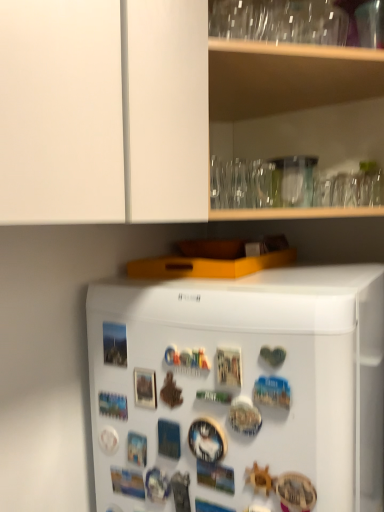
What do you see at coordinates (239, 391) in the screenshot? Image resolution: width=384 pixels, height=512 pixels. I see `white matte refrigerator at center` at bounding box center [239, 391].

What are the coordinates of `white matte refrigerator at center` in the screenshot? It's located at (239, 391).

Locate an element on the screen. transparent glassware at upper center is located at coordinates (103, 112).

In order to face transparent glassware at upper center, should I rotate leftwards or rightwards?

You should look right and rotate roughly 9.338 degrees.

The height and width of the screenshot is (512, 384). What do you see at coordinates (103, 112) in the screenshot? I see `transparent glassware at upper center` at bounding box center [103, 112].

You are a GUI agent. You are given a task and a screenshot of the screen. Output one action in this format:
    pyautogui.click(x=<x>, y=<y>)
    Task: Click on the white matte refrigerator at center
    This screenshot has width=384, height=512.
    Given the screenshot: What is the action you would take?
    pyautogui.click(x=239, y=391)

Is white matte refrigerator at center at the right side of transparent glassware at upper center?

No, white matte refrigerator at center is not to the right of transparent glassware at upper center.

Considering their positions, is white matte refrigerator at center located in front of or behind transparent glassware at upper center?

Visually, white matte refrigerator at center is located in front of transparent glassware at upper center.

Which point is more forward, (324, 461) or (188, 201)?

The point (324, 461) is closer.

From the image's perspective, between white matte refrigerator at center and transparent glassware at upper center, who is located below?

white matte refrigerator at center.

From a real-world perspective, between white matte refrigerator at center and transparent glassware at upper center, who is vertically lower?

In real-world perspective, white matte refrigerator at center is lower.

Which object is wider, white matte refrigerator at center or transparent glassware at upper center?

With larger width is white matte refrigerator at center.

Does white matte refrigerator at center have a greater height compared to transparent glassware at upper center?

Yes.

Considering the sizes of objects white matte refrigerator at center and transparent glassware at upper center in the image provided, who is bigger, white matte refrigerator at center or transparent glassware at upper center?

white matte refrigerator at center is bigger.

Would you say transparent glassware at upper center is part of white matte refrigerator at center's contents?

No, transparent glassware at upper center is not surrounded by white matte refrigerator at center.

Is there a large distance between white matte refrigerator at center and transparent glassware at upper center?

They are positioned close to each other.

Looking at this image, is white matte refrigerator at center turned away from transparent glassware at upper center?

No, transparent glassware at upper center is not at the back of white matte refrigerator at center.

This screenshot has height=512, width=384. Find the location of `cabinetry behind the white matte refrigerator at center`. cabinetry behind the white matte refrigerator at center is located at coordinates (103, 112).

Between transparent glassware at upper center and white matte refrigerator at center, which one appears on the right side from the viewer's perspective?

transparent glassware at upper center.

In the image, is transparent glassware at upper center positioned in front of or behind white matte refrigerator at center?

Clearly, transparent glassware at upper center is behind white matte refrigerator at center.

Considering the points (75, 110) and (91, 399), which point is in front, point (75, 110) or point (91, 399)?

Point (75, 110)

From the image's perspective, which one is positioned lower, transparent glassware at upper center or white matte refrigerator at center?

white matte refrigerator at center is shown below in the image.

In the scene shown: From a real-world perspective, is transparent glassware at upper center positioned above or below white matte refrigerator at center?

From a real-world perspective, transparent glassware at upper center is physically above white matte refrigerator at center.

Can you confirm if transparent glassware at upper center is wider than white matte refrigerator at center?

In fact, transparent glassware at upper center might be narrower than white matte refrigerator at center.

From their relative heights in the image, would you say transparent glassware at upper center is taller or shorter than white matte refrigerator at center?

Clearly, transparent glassware at upper center is shorter compared to white matte refrigerator at center.

Considering the sizes of transparent glassware at upper center and white matte refrigerator at center in the image, is transparent glassware at upper center bigger or smaller than white matte refrigerator at center?

In the image, transparent glassware at upper center appears to be smaller than white matte refrigerator at center.

Is transparent glassware at upper center positioned beyond the bounds of white matte refrigerator at center?

Yes.

Is transparent glassware at upper center not close to white matte refrigerator at center?

No, transparent glassware at upper center is in close proximity to white matte refrigerator at center.

Does transparent glassware at upper center turn towards white matte refrigerator at center?

No, transparent glassware at upper center is not facing towards white matte refrigerator at center.

What's the angular difference between transparent glassware at upper center and white matte refrigerator at center's facing directions?

There is a 43.3-degree angle between the facing directions of transparent glassware at upper center and white matte refrigerator at center.

How much distance is there between transparent glassware at upper center and white matte refrigerator at center?

transparent glassware at upper center and white matte refrigerator at center are 15.91 inches apart.

The image size is (384, 512). What are the coordinates of `refrigerator in front of the transparent glassware at upper center` in the screenshot? It's located at (239, 391).

Where is `refrigerator lying below the transparent glassware at upper center (from the image's perspective)`? Image resolution: width=384 pixels, height=512 pixels. refrigerator lying below the transparent glassware at upper center (from the image's perspective) is located at coordinates (239, 391).

The width and height of the screenshot is (384, 512). In order to click on refrigerator on the left of transparent glassware at upper center in this screenshot , I will do `click(239, 391)`.